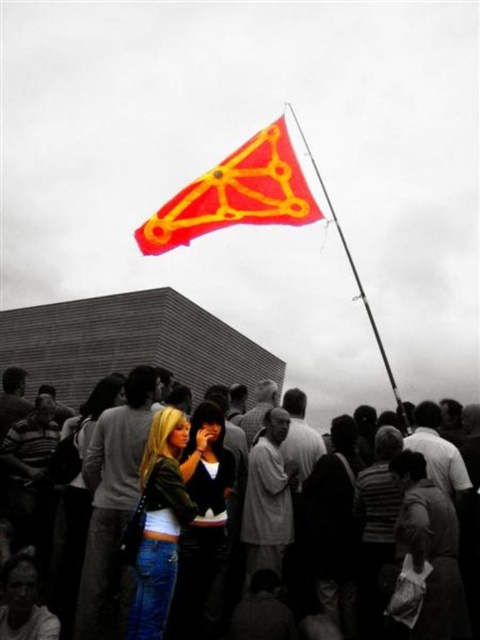
Question: Is red fabric flag at upper center positioned at the back of matte black crowd at center?

Choices:
 (A) yes
 (B) no

Answer: (A)

Question: Among these objects, which one is nearest to the camera?

Choices:
 (A) gray fabric shirt at center
 (B) light gray sweater at center
 (C) denim jacket at lower left

Answer: (C)

Question: Considering the real-world distances, which object is closest to the denim jacket at lower left?

Choices:
 (A) matte black crowd at center
 (B) matte green jacket at center

Answer: (B)

Question: Is red fabric flag at upper center to the left of denim jacket at lower left from the viewer's perspective?

Choices:
 (A) no
 (B) yes

Answer: (A)

Question: Which point is farther to the camera?

Choices:
 (A) (346, 604)
 (B) (126, 506)

Answer: (B)

Question: Can you confirm if red fabric flag at upper center is positioned below gray fabric shirt at center?

Choices:
 (A) yes
 (B) no

Answer: (B)